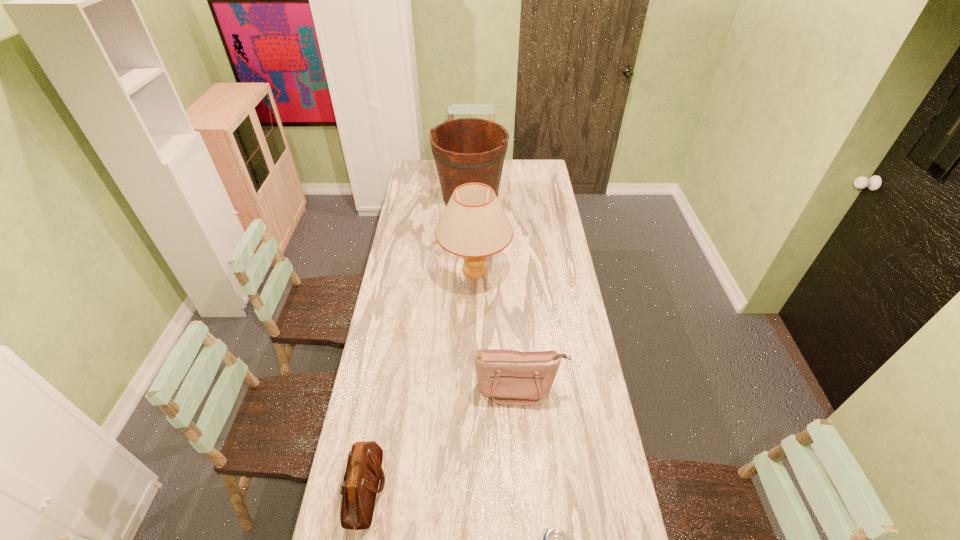
I want to click on lampshade, so click(x=474, y=225).

Identify the location of bucket. This screenshot has width=960, height=540. (469, 150).

The width and height of the screenshot is (960, 540). Identify the location of the farther shoulder bag. (509, 377).

This screenshot has height=540, width=960. I want to click on the right shoulder bag, so click(509, 377).

Locate an element on the screen. Image resolution: width=960 pixels, height=540 pixels. the leftmost object is located at coordinates (364, 471).

The width and height of the screenshot is (960, 540). I want to click on the second nearest object, so click(x=364, y=471).

The height and width of the screenshot is (540, 960). I want to click on vacant area located 0.060m on the left of the lampshade, so click(x=425, y=272).

I want to click on vacant space located 0.050m on the back of the bucket, so click(x=471, y=176).

Find the location of a particular element. The width and height of the screenshot is (960, 540). free space located 0.070m on the front pocket of the third nearest object is located at coordinates (523, 427).

The width and height of the screenshot is (960, 540). I want to click on vacant space positioned on the right of the left shoulder bag, so click(x=492, y=488).